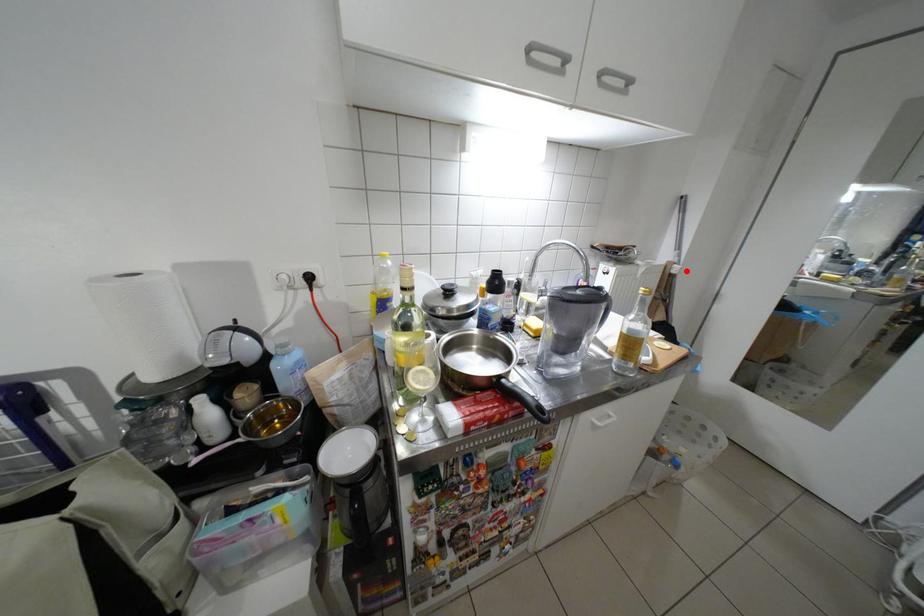
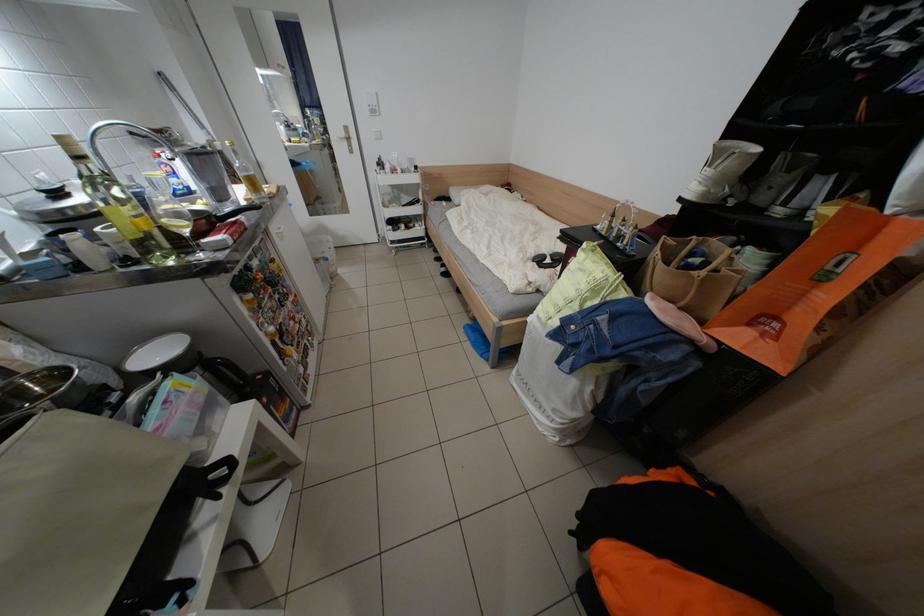
In the second image, find the point that corresponds to the highlighted location in the first image.

(231, 148)